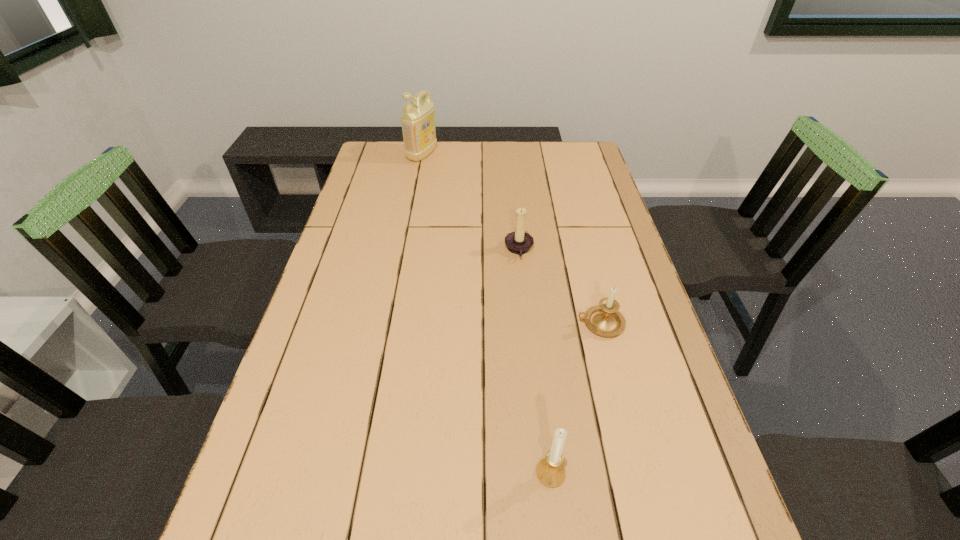
Identify the location of the leftmost object. (418, 118).

The height and width of the screenshot is (540, 960). I want to click on detergent, so click(418, 118).

Locate an element on the screen. This screenshot has height=540, width=960. the nearest candle holder is located at coordinates (550, 471).

I want to click on the second farthest object, so click(519, 242).

You are a GUI agent. You are given a task and a screenshot of the screen. Output one action in this format:
    pyautogui.click(x=<x>, y=<y>)
    Task: Click on the rightmost candle holder
    
    Given the screenshot: What is the action you would take?
    pyautogui.click(x=604, y=319)

The width and height of the screenshot is (960, 540). What are the coordinates of `the third farthest object` in the screenshot? It's located at (604, 319).

Identify the location of vacant area located on the right of the detergent. The image size is (960, 540). (489, 154).

Locate an element on the screen. This screenshot has width=960, height=540. free space located on the back of the nearest candle holder is located at coordinates (533, 313).

At what (x,y) coordinates should I click in order to perform the action: click on vacant position located on the wick of the second farthest object. Please return your answer as a coordinate pair (x, y). The image size is (960, 540). Looking at the image, I should click on (419, 250).

The image size is (960, 540). Identify the location of vacant area situated on the wick of the second farthest object. (378, 250).